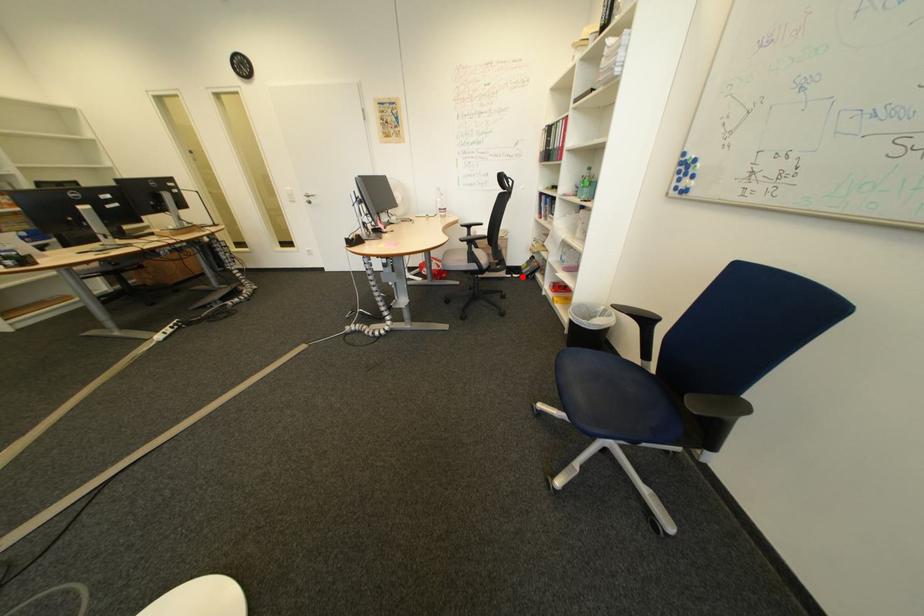
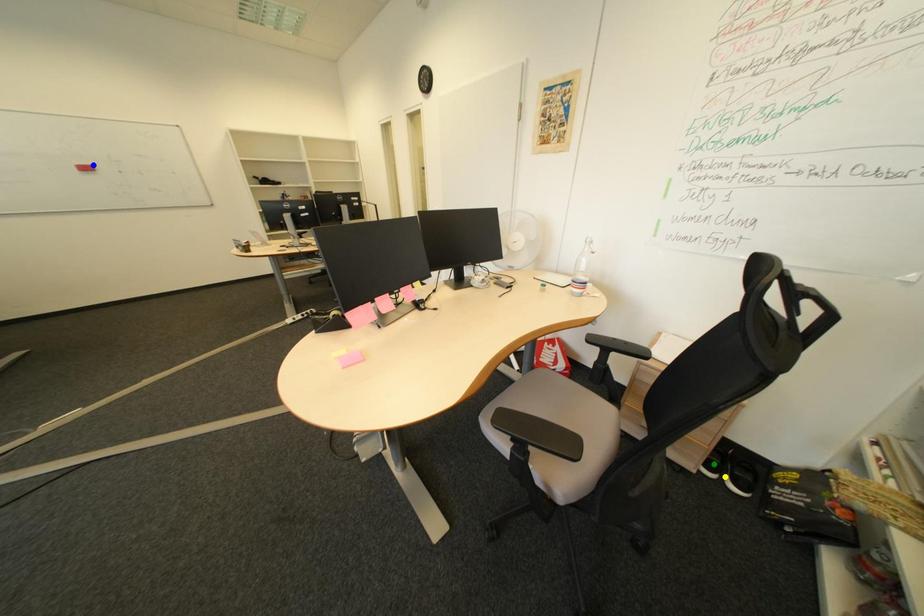
Question: I am providing you with two images of the same scene from different viewpoints. A red point is marked on the first image. You are given multiple points on the second image. In image 2, which mark is for the same physical point as the one in image 1?

Choices:
 (A) green point
 (B) yellow point
 (C) blue point

Answer: (B)